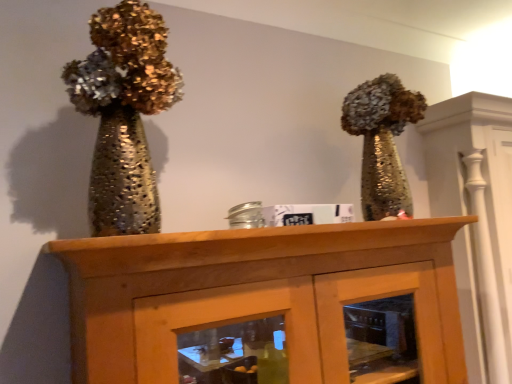
Question: Looking at their shapes, would you say shiny metallic vase at left is wider or thinner than wooden cabinet at center?

Choices:
 (A) thin
 (B) wide

Answer: (A)

Question: Would you say shiny metallic vase at left is to the left or to the right of wooden cabinet at center in the picture?

Choices:
 (A) left
 (B) right

Answer: (A)

Question: In terms of height, does shiny metallic vase at left look taller or shorter compared to wooden cabinet at center?

Choices:
 (A) tall
 (B) short

Answer: (B)

Question: Based on their sizes in the image, would you say wooden cabinet at center is bigger or smaller than shiny metallic vase at left?

Choices:
 (A) big
 (B) small

Answer: (A)

Question: Is wooden cabinet at center wider or thinner than shiny metallic vase at left?

Choices:
 (A) wide
 (B) thin

Answer: (A)

Question: Based on their positions, is wooden cabinet at center located to the left or right of shiny metallic vase at left?

Choices:
 (A) left
 (B) right

Answer: (B)

Question: In the image, is wooden cabinet at center positioned in front of or behind shiny metallic vase at left?

Choices:
 (A) behind
 (B) front

Answer: (B)